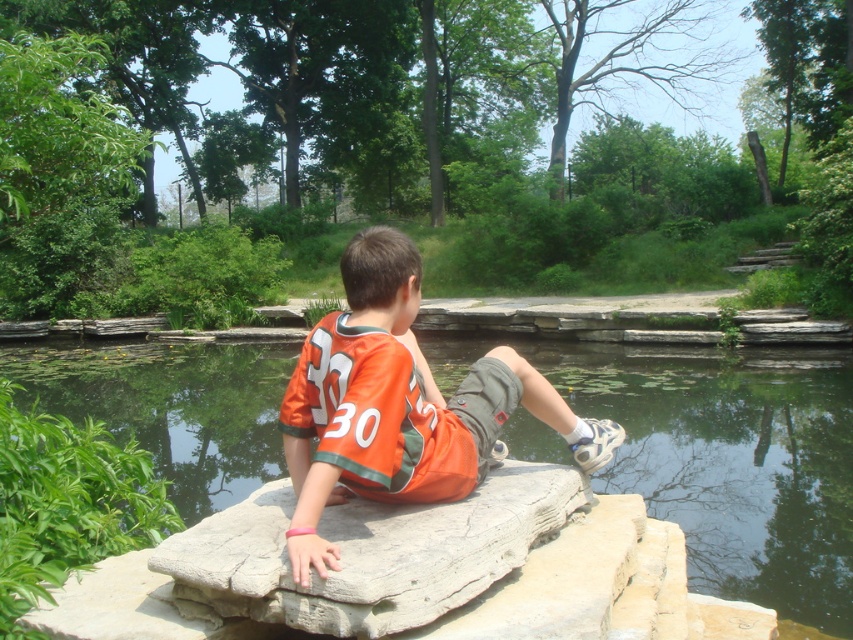
Does greenish water at center appear on the left side of orange jersey at center?

Indeed, greenish water at center is positioned on the left side of orange jersey at center.

Is greenish water at center wider than orange jersey at center?

Correct, the width of greenish water at center exceeds that of orange jersey at center.

Where is `greenish water at center`? greenish water at center is located at coordinates (732, 464).